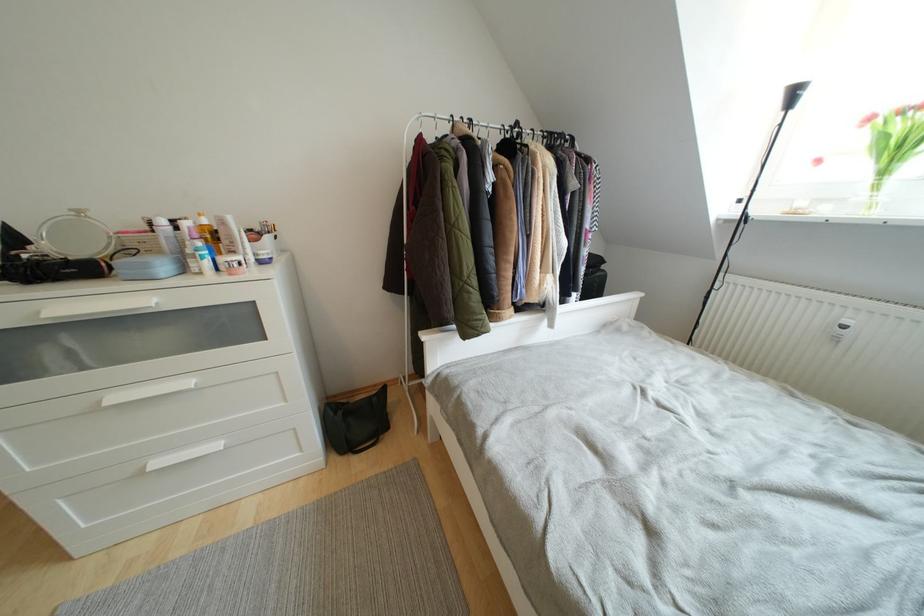
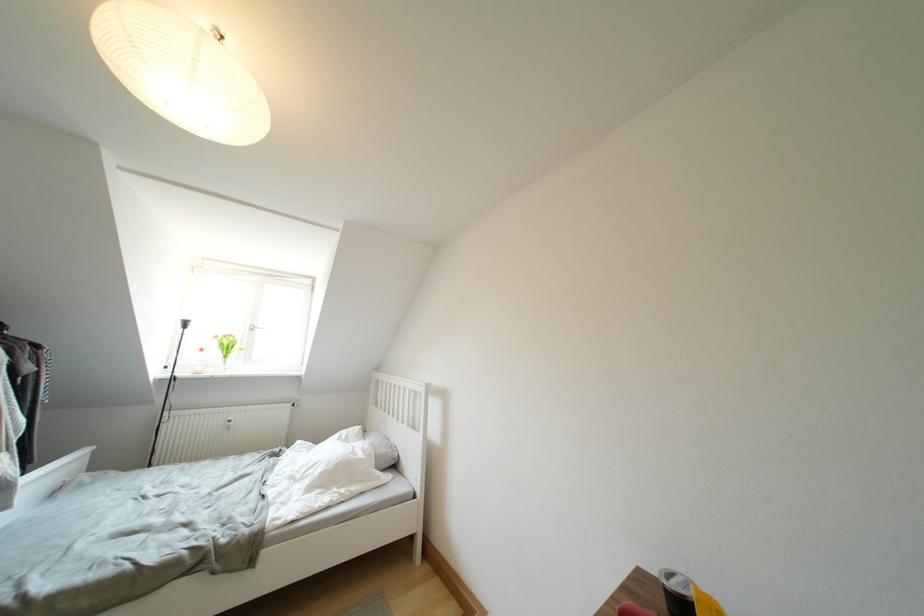
In the second image, find the point that corresponds to (877,122) in the first image.

(222, 341)